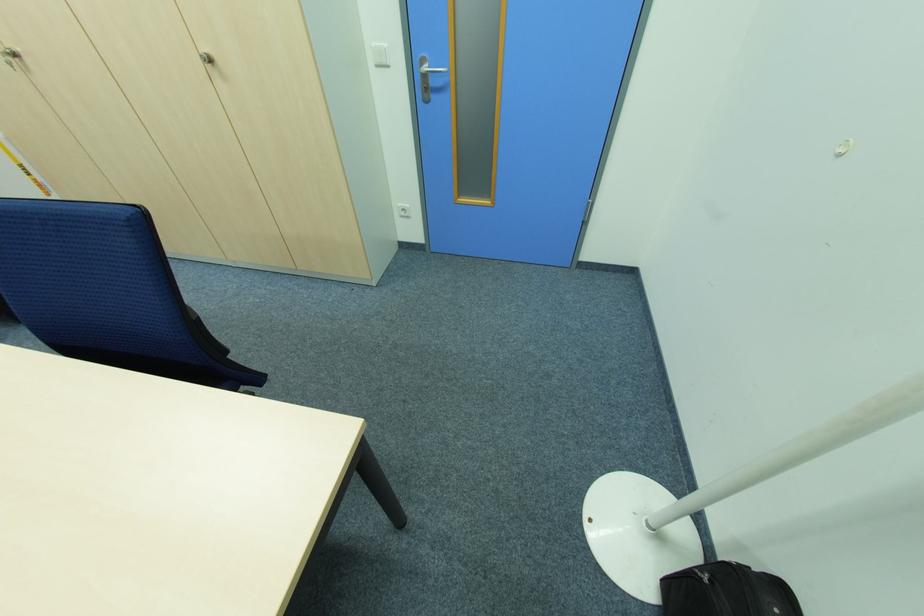
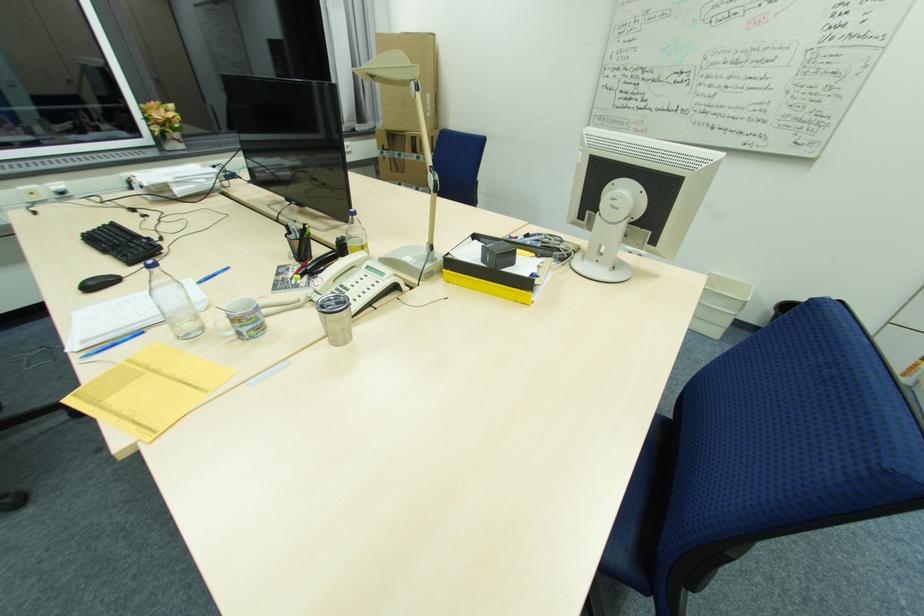
The first image is from the beginning of the video and the second image is from the end. How did the camera likely rotate when shooting the video?

The camera rotated toward left-down.